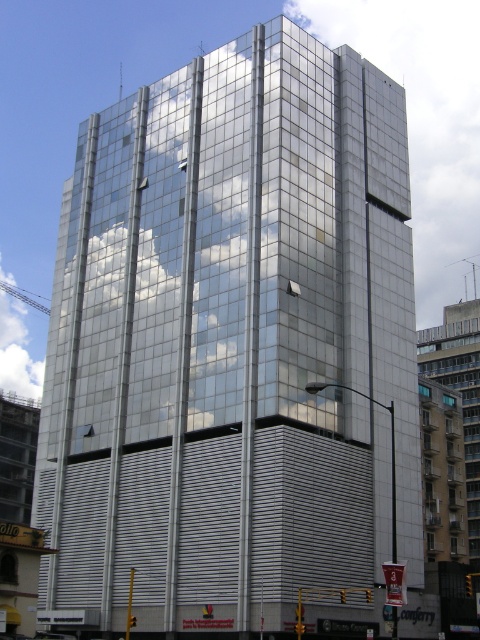
Question: Does transparent glass cloud at center appear over white fluffy cloud at upper left?

Choices:
 (A) yes
 (B) no

Answer: (A)

Question: Which point is farther to the camera?

Choices:
 (A) (22, 340)
 (B) (358, 19)

Answer: (B)

Question: Does transparent glass cloud at center appear on the left side of white fluffy cloud at upper left?

Choices:
 (A) yes
 (B) no

Answer: (B)

Question: Is transparent glass cloud at center to the left of white fluffy cloud at upper left from the viewer's perspective?

Choices:
 (A) no
 (B) yes

Answer: (A)

Question: Among these objects, which one is farthest from the camera?

Choices:
 (A) white fluffy cloud at upper left
 (B) transparent glass cloud at center

Answer: (A)